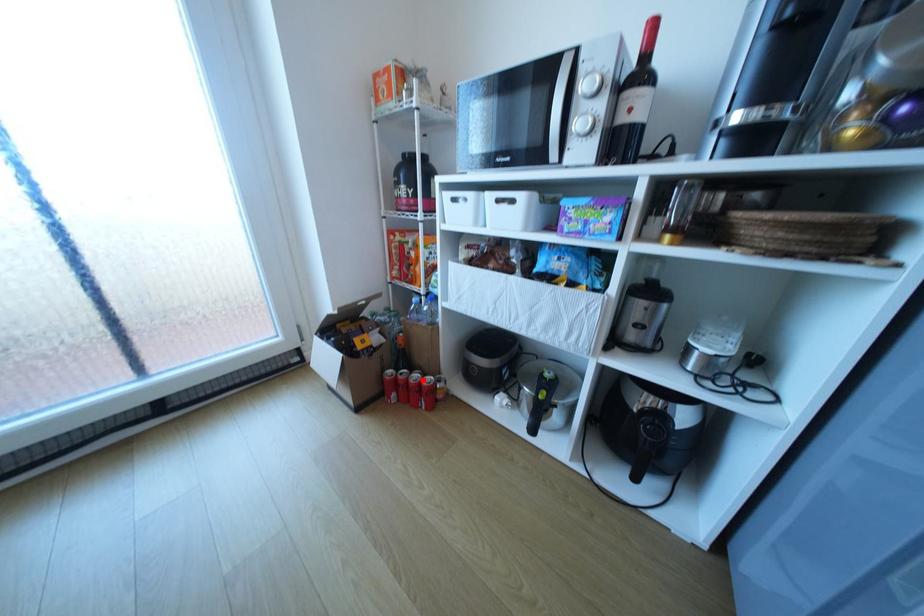
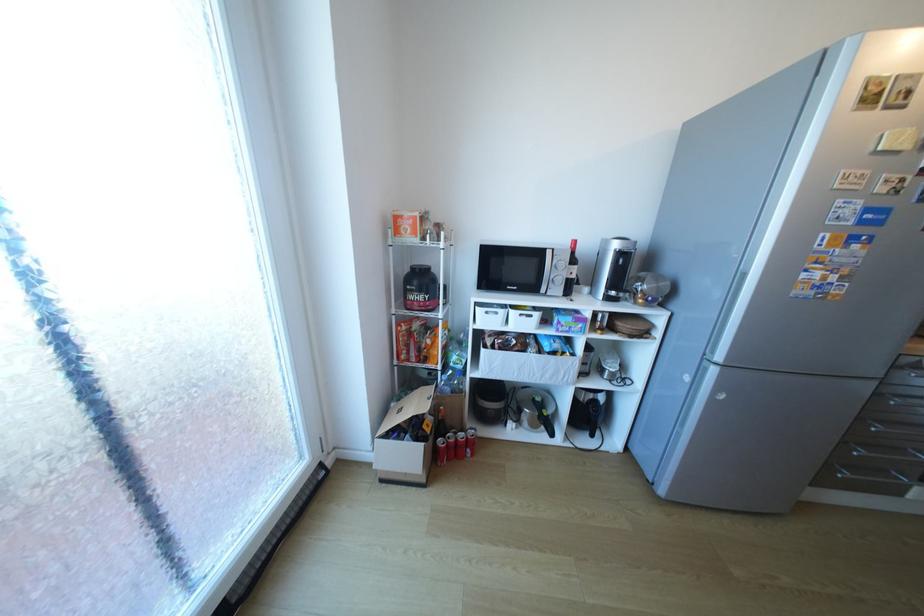
Locate, in the second image, the point that corresponds to the highlighted location in the first image.

(469, 439)